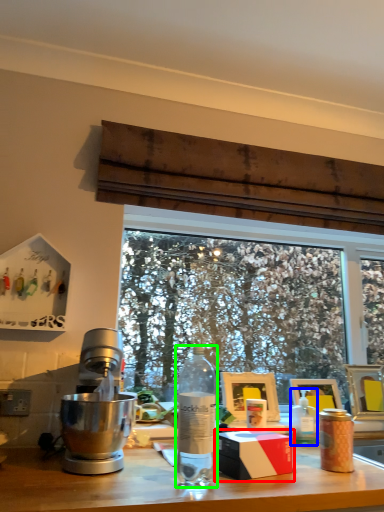
Question: Which is nearer to the box (highlighted by a red box)? bottle (highlighted by a blue box) or bottle (highlighted by a green box).

Choices:
 (A) bottle
 (B) bottle

Answer: (B)